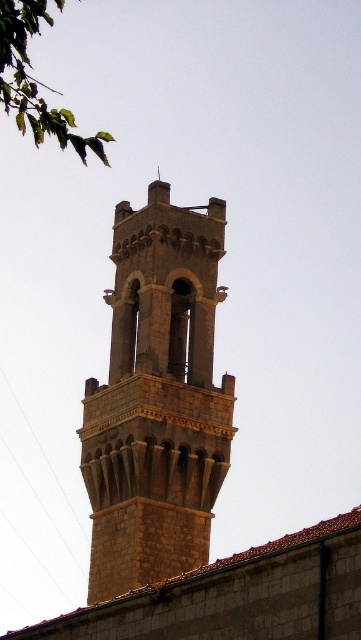
Does stone tower at center appear on the right side of green leafy branch at upper left?

Indeed, stone tower at center is positioned on the right side of green leafy branch at upper left.

Who is taller, stone tower at center or green leafy branch at upper left?

With more height is stone tower at center.

Locate an element on the screen. stone tower at center is located at coordinates (157, 400).